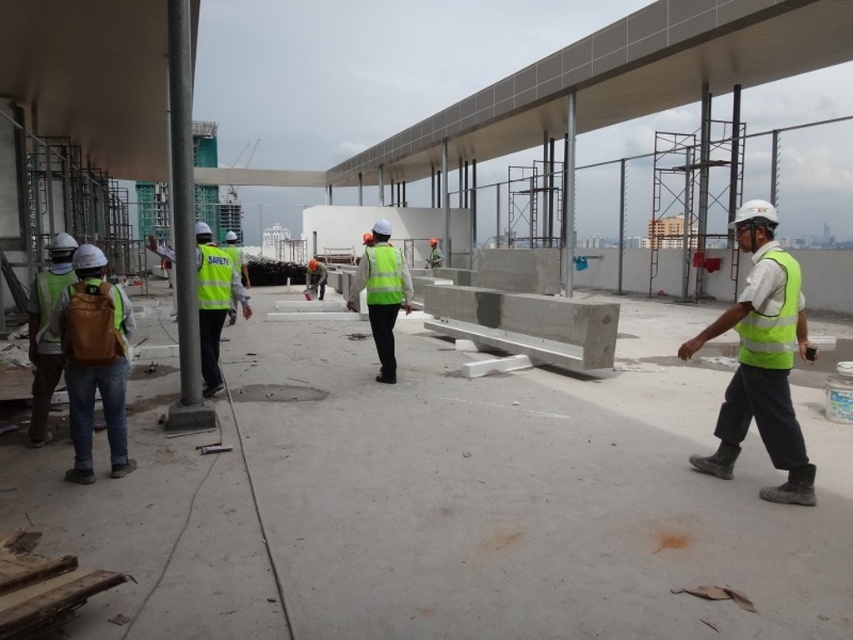
Is green reflective vest at center further to camera compared to brown fabric vest at left?

Yes, it is behind brown fabric vest at left.

Can you confirm if green reflective vest at center is smaller than brown fabric vest at left?

Yes, green reflective vest at center is smaller than brown fabric vest at left.

Identify the location of green reflective vest at center. The image size is (853, 640). (381, 292).

Can you confirm if yellow reflective vest at right is shorter than brown fabric backpack at left?

Incorrect, yellow reflective vest at right's height does not fall short of brown fabric backpack at left's.

Does yellow reflective vest at right have a larger size compared to brown fabric backpack at left?

Yes, yellow reflective vest at right is bigger than brown fabric backpack at left.

The image size is (853, 640). What do you see at coordinates (761, 360) in the screenshot? I see `yellow reflective vest at right` at bounding box center [761, 360].

Locate an element on the screen. This screenshot has height=640, width=853. yellow reflective vest at right is located at coordinates (761, 360).

This screenshot has height=640, width=853. What do you see at coordinates (94, 360) in the screenshot? I see `brown fabric backpack at left` at bounding box center [94, 360].

Is point (120, 392) less distant than point (355, 285)?

Yes.

Between point (114, 474) and point (383, 280), which one is positioned in front?

Positioned in front is point (114, 474).

You are a GUI agent. You are given a task and a screenshot of the screen. Output one action in this format:
    pyautogui.click(x=<x>, y=<y>)
    Task: Click on the brown fabric backpack at left
    The width and height of the screenshot is (853, 640).
    Given the screenshot: What is the action you would take?
    pyautogui.click(x=94, y=360)